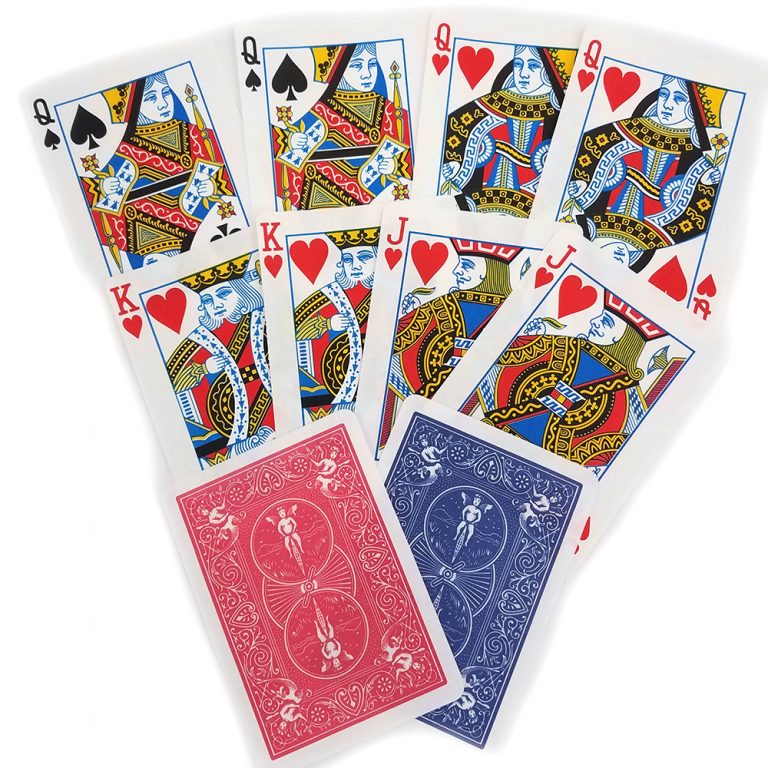
Find the location of a particular element. The width and height of the screenshot is (768, 768). playing cards is located at coordinates (134, 164), (343, 131), (497, 147), (624, 161), (190, 310), (335, 316), (432, 315), (538, 333), (266, 520), (429, 482).